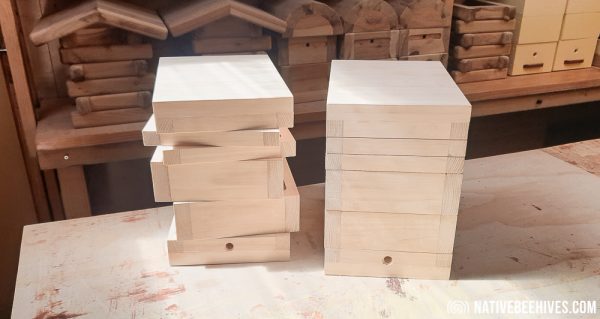
Where is `wood grain`? Image resolution: width=600 pixels, height=319 pixels. wood grain is located at coordinates (538, 219), (540, 186), (576, 270), (183, 280), (525, 273), (393, 288).